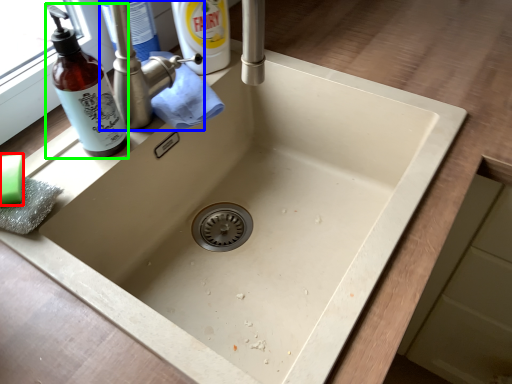
Question: Estimate the real-world distances between objects in this image. Which object is farther from soap (highlighted by a red box), tap (highlighted by a blue box) or bottle (highlighted by a green box)?

Choices:
 (A) tap
 (B) bottle

Answer: (A)